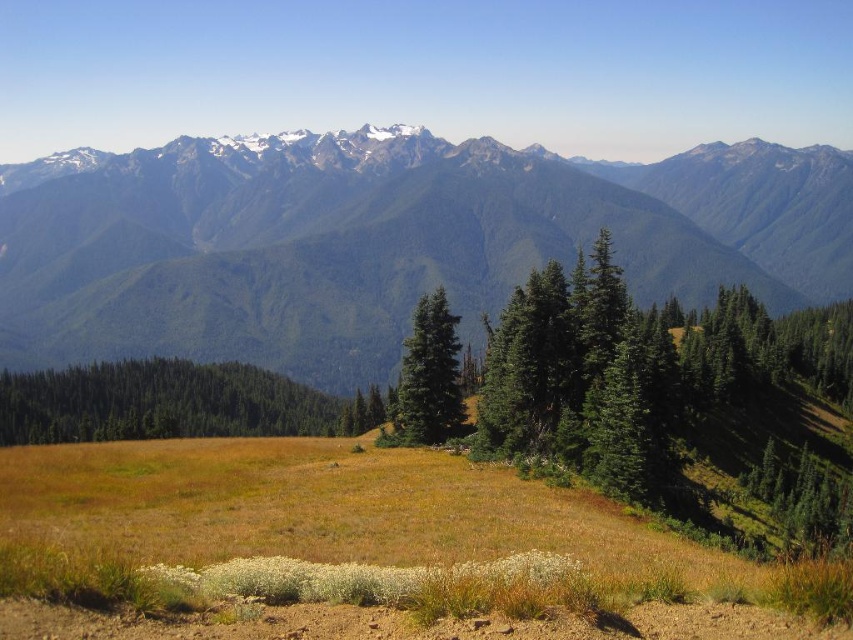
You are standing at the point marked as point (169, 403) in the image. Looking around, you see a green matte tree at left. What direction is the green matte tree located relative to your current position?

The green matte tree at left is located to the left of your current position at point (169, 403).

You are planning to take a photo of the green forested mountain range at upper center and the green matte tree at left. Which object will occupy more space in the photo frame?

The green forested mountain range at upper center will occupy more space in the photo frame because its width is larger than that of the green matte tree at left.